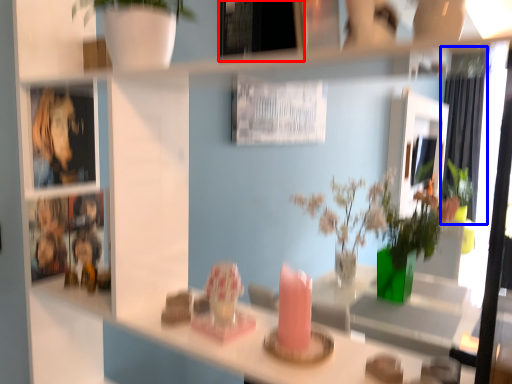
Question: Which point is further to the camera, picture frame (highlighted by a red box) or curtain (highlighted by a blue box)?

Choices:
 (A) picture frame
 (B) curtain

Answer: (B)